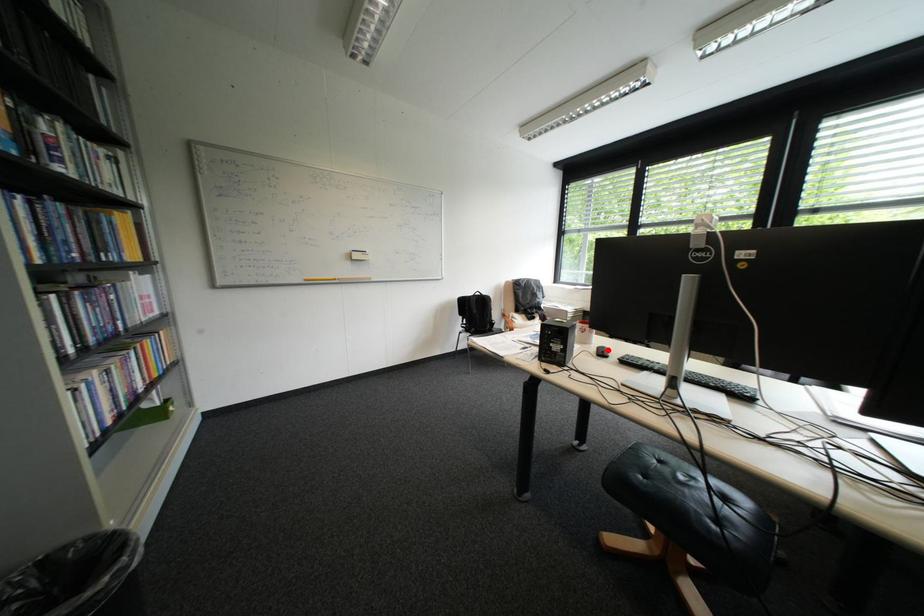
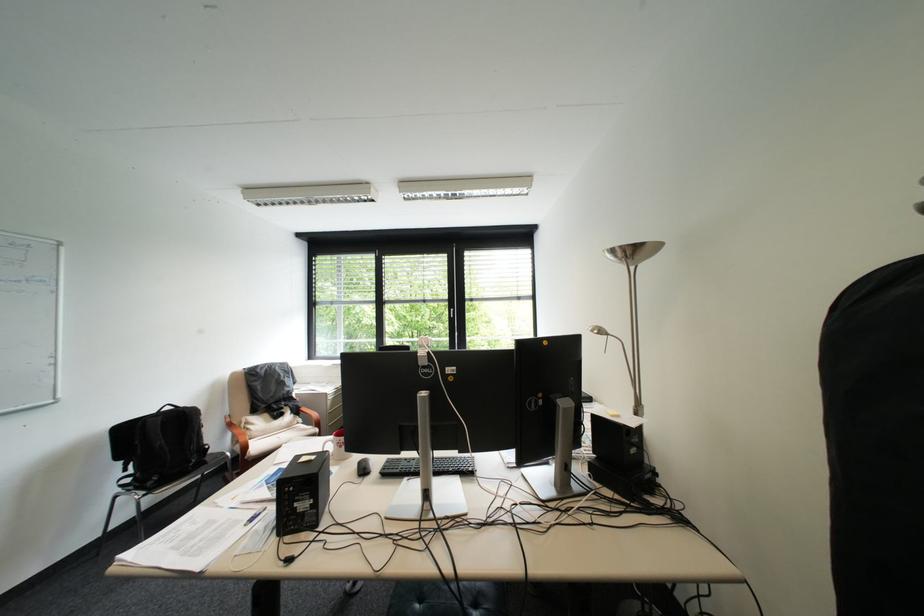
The point at the highlighted location is marked in the first image. Where is the corresponding point in the second image?

(369, 467)